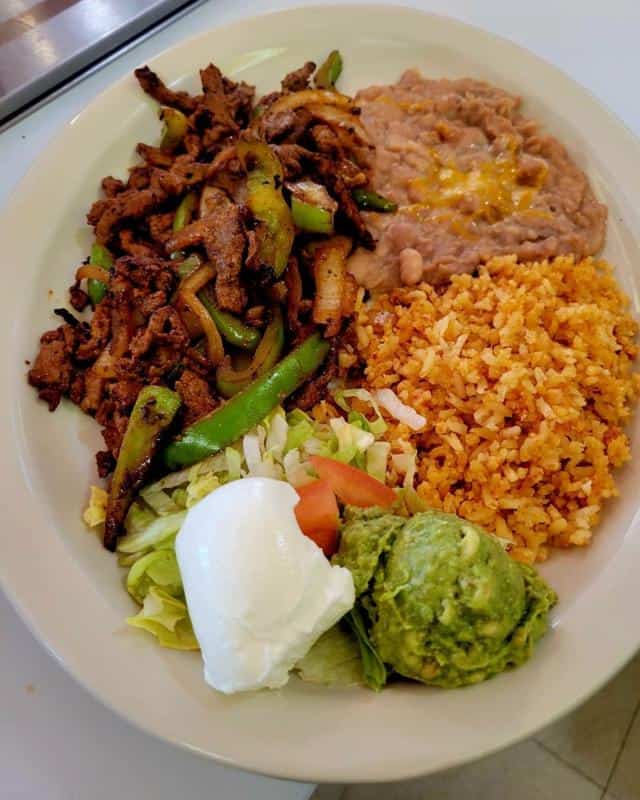
Identify the location of white plate, with indentation in center. The image size is (640, 800). (58, 221), (362, 72).